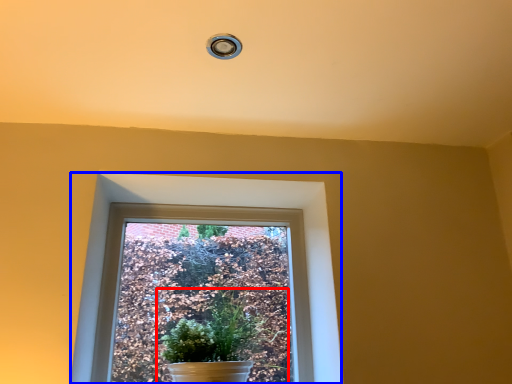
Question: Among these objects, which one is nearest to the camera, houseplant (highlighted by a red box) or window (highlighted by a blue box)?

Choices:
 (A) houseplant
 (B) window

Answer: (A)